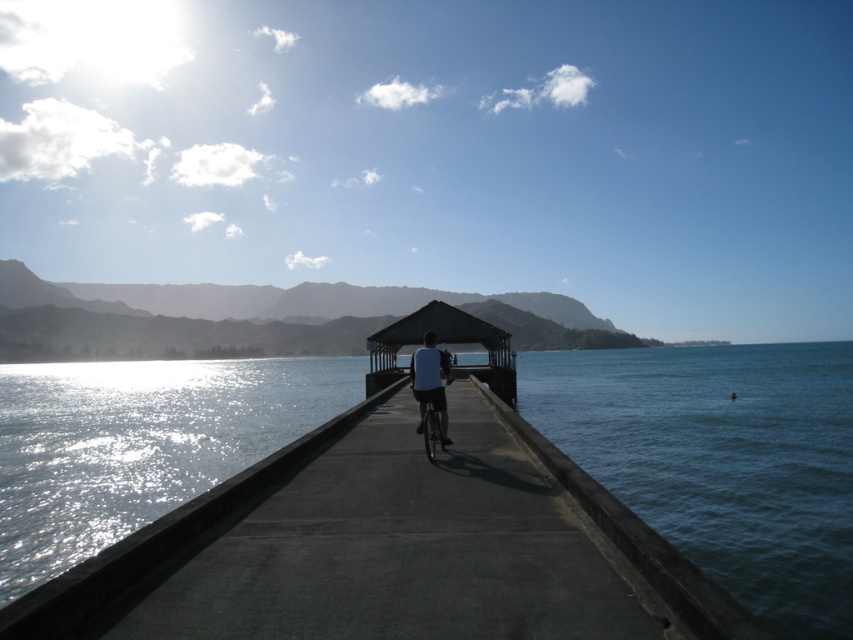
Can you confirm if concrete pier at center is shorter than white matte shirt at center?

Correct, concrete pier at center is not as tall as white matte shirt at center.

Looking at this image, who is taller, concrete pier at center or white matte shirt at center?

With more height is white matte shirt at center.

Who is more forward, (206, 561) or (448, 444)?

Point (206, 561) is in front.

Locate an element on the screen. concrete pier at center is located at coordinates (395, 548).

Which is below, concrete pier at center or matte black shelter at center?

matte black shelter at center is lower down.

Between concrete pier at center and matte black shelter at center, which one appears on the left side from the viewer's perspective?

Positioned to the left is concrete pier at center.

Is point (538, 508) less distant than point (469, 339)?

Yes, point (538, 508) is in front of point (469, 339).

Find the location of `concrete pier at center`. concrete pier at center is located at coordinates (395, 548).

Is blue water at lower right further to camera compared to white matte shirt at center?

No, blue water at lower right is in front of white matte shirt at center.

Does blue water at lower right have a greater width compared to white matte shirt at center?

Correct, the width of blue water at lower right exceeds that of white matte shirt at center.

What do you see at coordinates (721, 461) in the screenshot? This screenshot has width=853, height=640. I see `blue water at lower right` at bounding box center [721, 461].

This screenshot has width=853, height=640. Identify the location of blue water at lower right. (721, 461).